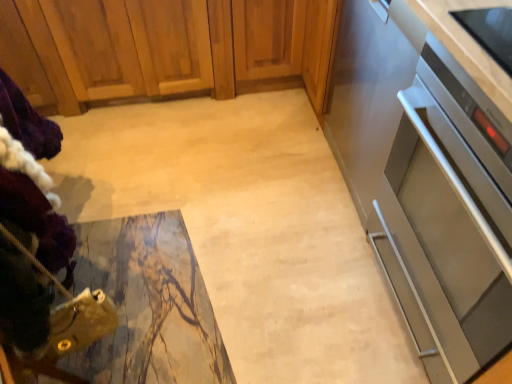
Question: Is wooden cabinet at upper left turned away from stainless steel oven at right?

Choices:
 (A) yes
 (B) no

Answer: (B)

Question: Is wooden cabinet at upper left to the right of stainless steel oven at right from the viewer's perspective?

Choices:
 (A) no
 (B) yes

Answer: (A)

Question: Can you confirm if wooden cabinet at upper left is shorter than stainless steel oven at right?

Choices:
 (A) no
 (B) yes

Answer: (B)

Question: From the image's perspective, is wooden cabinet at upper left above stainless steel oven at right?

Choices:
 (A) yes
 (B) no

Answer: (A)

Question: Is wooden cabinet at upper left located outside stainless steel oven at right?

Choices:
 (A) no
 (B) yes

Answer: (B)

Question: Can you see wooden cabinet at upper left touching stainless steel oven at right?

Choices:
 (A) yes
 (B) no

Answer: (B)

Question: Is the surface of wooden cabinet at upper left in direct contact with satin silver oven at right?

Choices:
 (A) yes
 (B) no

Answer: (B)

Question: Is satin silver oven at right completely or partially inside wooden cabinet at upper left?

Choices:
 (A) yes
 (B) no

Answer: (B)

Question: Does wooden cabinet at upper left have a larger size compared to satin silver oven at right?

Choices:
 (A) no
 (B) yes

Answer: (B)

Question: From a real-world perspective, is wooden cabinet at upper left on satin silver oven at right?

Choices:
 (A) yes
 (B) no

Answer: (B)

Question: Could you tell me if wooden cabinet at upper left is turned towards satin silver oven at right?

Choices:
 (A) yes
 (B) no

Answer: (B)

Question: From the image's perspective, is wooden cabinet at upper left on top of satin silver oven at right?

Choices:
 (A) no
 (B) yes

Answer: (B)

Question: From the image's perspective, is satin silver oven at right on wooden cabinet at upper left?

Choices:
 (A) yes
 (B) no

Answer: (B)